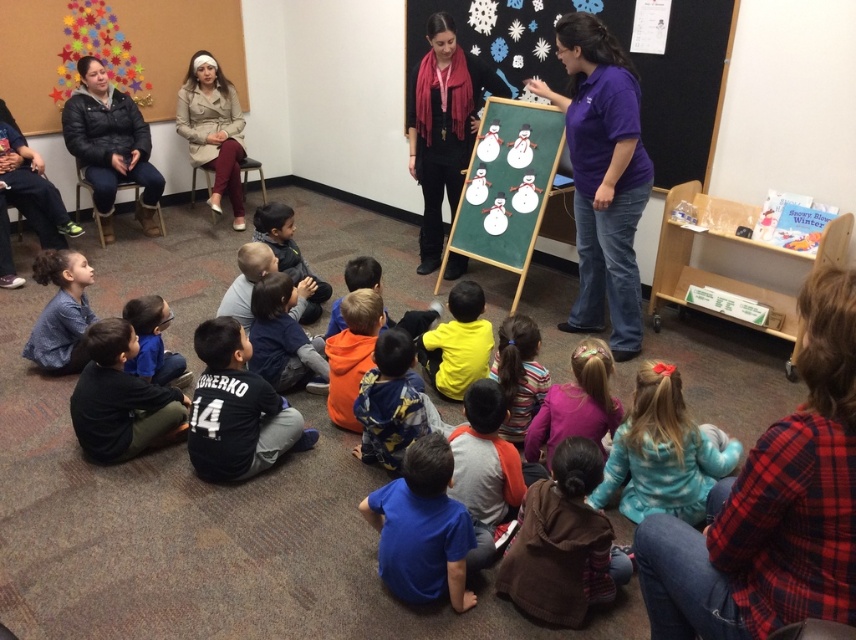
Can you confirm if purple cotton shirt at center is positioned to the left of blue fleece jacket at lower left?

No, purple cotton shirt at center is not to the left of blue fleece jacket at lower left.

This screenshot has width=856, height=640. Identify the location of purple cotton shirt at center. (602, 177).

Image resolution: width=856 pixels, height=640 pixels. I want to click on purple cotton shirt at center, so click(602, 177).

Who is shorter, blue polka dot shirt at lower center or black jersey at lower left?

Standing shorter between the two is blue polka dot shirt at lower center.

Is blue polka dot shirt at lower center bigger than black jersey at lower left?

Yes, blue polka dot shirt at lower center is bigger than black jersey at lower left.

Is point (643, 435) farther from camera compared to point (132, 336)?

No, it is in front of (132, 336).

Where is `blue polka dot shirt at lower center`? blue polka dot shirt at lower center is located at coordinates (663, 452).

Between purple cotton shirt at center and beige trench coat at upper left, which one appears on the left side from the viewer's perspective?

beige trench coat at upper left is more to the left.

Where is `purple cotton shirt at center`? purple cotton shirt at center is located at coordinates (602, 177).